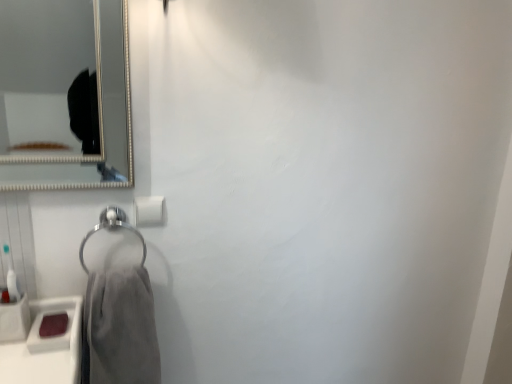
Question: Looking at the image, does gray cotton towel at lower left seem bigger or smaller compared to matte pink soap at lower left?

Choices:
 (A) big
 (B) small

Answer: (A)

Question: From the image's perspective, is gray cotton towel at lower left positioned above or below matte pink soap at lower left?

Choices:
 (A) above
 (B) below

Answer: (B)

Question: Which of these objects is positioned farthest from the white matte toilet paper at center?

Choices:
 (A) matte pink soap at lower left
 (B) satin silver towel ring at lower left
 (C) gray cotton towel at lower left

Answer: (A)

Question: Which of these objects is positioned closest to the matte pink soap at lower left?

Choices:
 (A) white matte toilet paper at center
 (B) satin silver towel ring at lower left
 (C) gray cotton towel at lower left

Answer: (C)